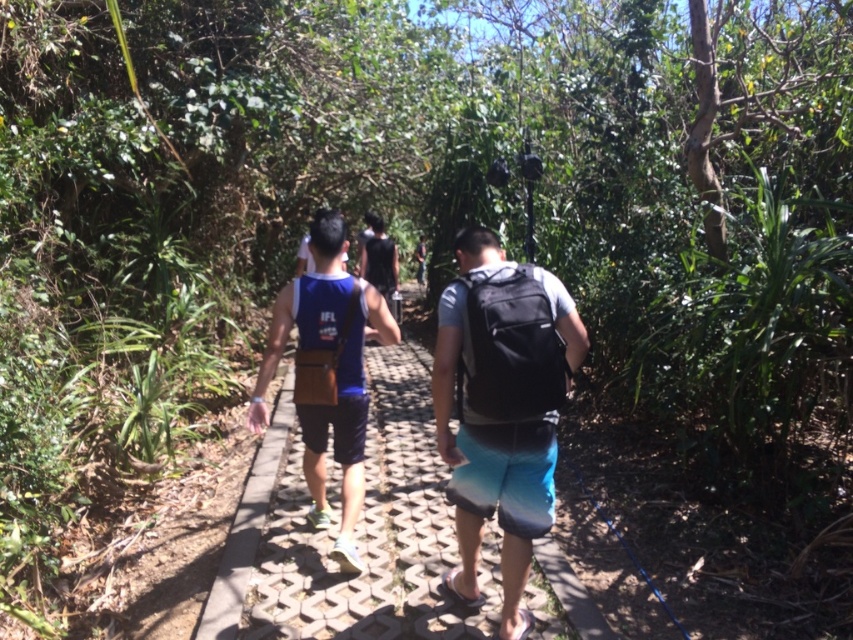
You are a photographer trying to capture a clear shot of both the black matte backpack at center and the blue fabric tank top at center. Since you want to focus on the backpack first, which object should you adjust your camera to prioritize in terms of depth of field?

The black matte backpack at center is closer to the viewer than the blue fabric tank top at center, so you should prioritize focusing on the black matte backpack at center to ensure it is in sharp focus while the tank top may appear slightly blurred.

You are a hiker on the pathway and want to check if your blue fabric backpack at center is visible from above. Since you see the blue fabric tank top at center, can you see the backpack?

The blue fabric backpack at center is positioned under the blue fabric tank top at center, so it is not visible from above because it is covered by the tank top.

You are a hiker planning to carry both the blue fabric backpack at center and the blue fabric tank top at center. Which item has a smaller width and is easier to fit into a narrow space?

The blue fabric backpack at center has a smaller width than the blue fabric tank top at center, making it easier to fit into a narrow space.